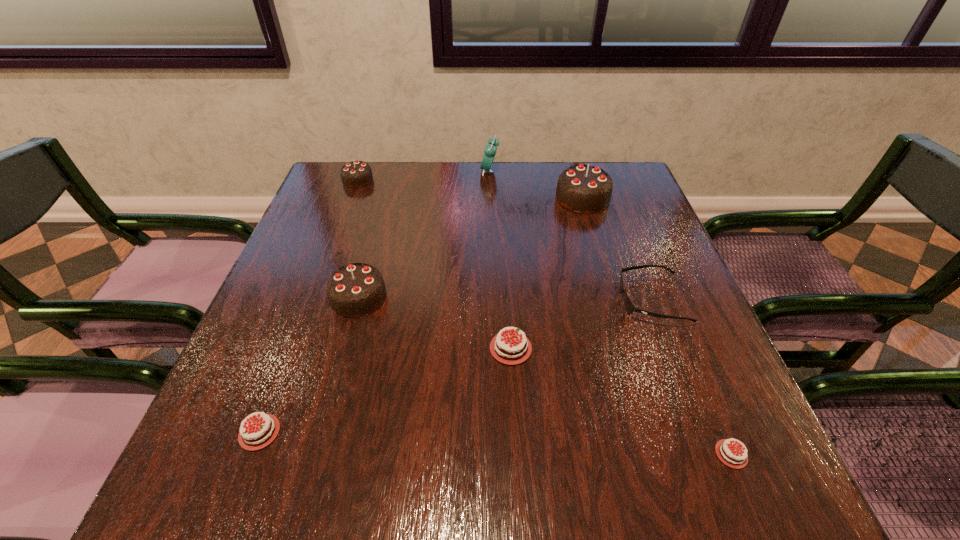
You are a GUI agent. You are given a task and a screenshot of the screen. Output one action in this format:
    pyautogui.click(x=<x>, y=<y>)
    Task: Click on the free space that is in between the fifth shortest object and the biggest chocolate chocolate cake
    Image resolution: width=960 pixels, height=540 pixels.
    Given the screenshot: What is the action you would take?
    pyautogui.click(x=470, y=189)

The image size is (960, 540). Find the location of `free space between the nearest chocolate chocolate cake and the fourth tallest chocolate cake`. free space between the nearest chocolate chocolate cake and the fourth tallest chocolate cake is located at coordinates (435, 323).

The height and width of the screenshot is (540, 960). Identify the location of vacant area between the rightmost chocolate chocolate cake and the alarm clock. (536, 185).

Where is `vacant space that's between the alarm clock and the smallest chocolate chocolate cake`? Image resolution: width=960 pixels, height=540 pixels. vacant space that's between the alarm clock and the smallest chocolate chocolate cake is located at coordinates (423, 176).

The width and height of the screenshot is (960, 540). Find the location of `free point between the alarm clock and the sunglasses`. free point between the alarm clock and the sunglasses is located at coordinates point(570,235).

Locate an element on the screen. The width and height of the screenshot is (960, 540). free area in between the tallest chocolate cake and the nearest chocolate chocolate cake is located at coordinates (470, 248).

Find the location of a particular element. This screenshot has height=540, width=960. blank region between the fourth tallest chocolate cake and the sunglasses is located at coordinates (581, 324).

Locate which object is the fifth closest to the shortest object. Please provide its 2D coordinates. Your answer should be formatted as a tuple, i.e. [(x, y)], where the tuple contains the x and y coordinates of a point satisfying the conditions above.

[(259, 434)]

Locate an element on the screen. Image resolution: width=960 pixels, height=540 pixels. object that stands as the closest to the third tallest chocolate cake is located at coordinates (490, 150).

Point out which chocolate cake is positioned as the fifth nearest to the fourth tallest chocolate cake. Please provide its 2D coordinates. Your answer should be formatted as a tuple, i.e. [(x, y)], where the tuple contains the x and y coordinates of a point satisfying the conditions above.

[(355, 174)]